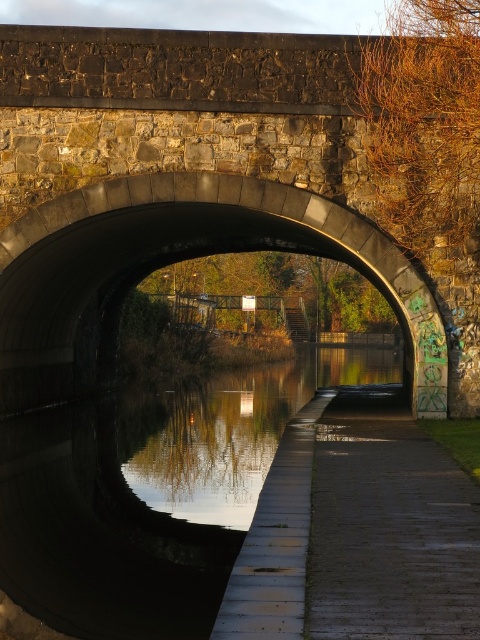
Is smooth concrete bridge at center positioned in front of dark gray concrete path at center?

No, it is behind dark gray concrete path at center.

Between smooth concrete bridge at center and dark gray concrete path at center, which one is positioned lower?

dark gray concrete path at center is below.

Is point (158, 182) in front of point (336, 499)?

No, (158, 182) is behind (336, 499).

At what (x,y) coordinates should I click in order to perform the action: click on smooth concrete bridge at center. Please return your answer as a coordinate pair (x, y). Looking at the image, I should click on (183, 257).

Does point (6, 528) lie behind point (40, 241)?

No, (6, 528) is in front of (40, 241).

Does dark reflective water at center have a smaller size compared to smooth concrete bridge at center?

Actually, dark reflective water at center might be larger than smooth concrete bridge at center.

Is point (218, 394) more distant than point (73, 298)?

Yes, it is behind point (73, 298).

The height and width of the screenshot is (640, 480). In order to click on dark reflective water at center in this screenshot , I will do pos(149,493).

Who is positioned more to the left, dark reflective water at center or dark gray concrete path at center?

dark reflective water at center is more to the left.

Which is below, dark reflective water at center or dark gray concrete path at center?

dark reflective water at center is lower down.

Find the location of a particular element. The image size is (480, 640). dark reflective water at center is located at coordinates (149, 493).